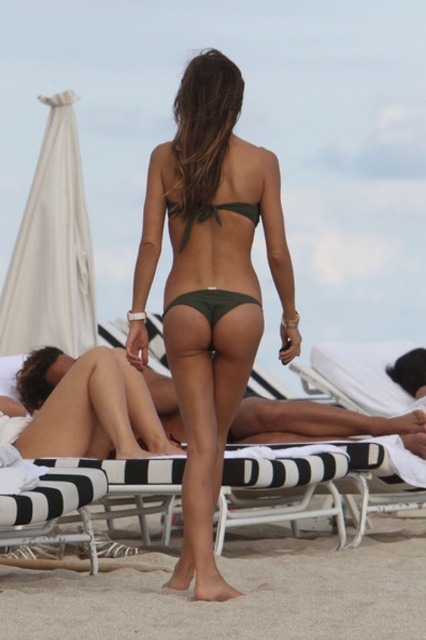
Question: Is green matte bikini bottom at center positioned before green matte bikini top at center?

Choices:
 (A) no
 (B) yes

Answer: (B)

Question: Can you confirm if green matte bikini bottom at center is smaller than green matte bikini top at center?

Choices:
 (A) yes
 (B) no

Answer: (B)

Question: Which is nearer to the green matte bikini at center?

Choices:
 (A) black striped beach chair at center
 (B) green matte bikini bottom at center
 (C) green matte bikini top at center

Answer: (C)

Question: Is green matte bikini bottom at center thinner than green matte bikini at center?

Choices:
 (A) yes
 (B) no

Answer: (B)

Question: Which point is closer to the camera?

Choices:
 (A) green matte bikini top at center
 (B) sandy beach at lower center
 (C) green matte bikini bottom at center
 (D) green matte bikini at center

Answer: (B)

Question: Estimate the real-world distances between objects in this image. Which object is farther from the green matte bikini at center?

Choices:
 (A) black striped beach chair at center
 (B) green matte bikini top at center
 (C) sandy beach at lower center
 (D) green matte bikini bottom at center

Answer: (C)